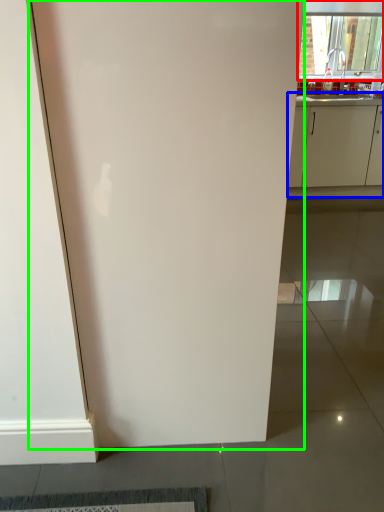
Question: Which object is the farthest from window (highlighted by a red box)? Choose among these: cabinetry (highlighted by a blue box) or door (highlighted by a green box).

Choices:
 (A) cabinetry
 (B) door

Answer: (B)